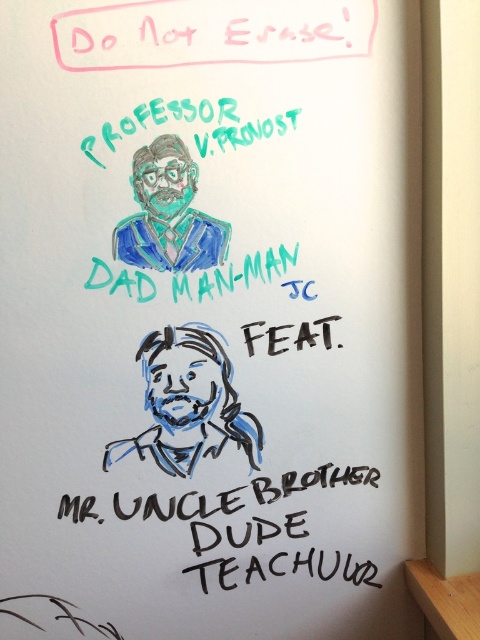
Is blue sketchy man at center taller than black marker text at lower center?

Indeed, blue sketchy man at center has a greater height compared to black marker text at lower center.

Locate an element on the screen. This screenshot has height=640, width=480. blue sketchy man at center is located at coordinates (189, 403).

Can you confirm if blue sketchy man at center is positioned to the left of teal matte suit at upper center?

Yes, blue sketchy man at center is to the left of teal matte suit at upper center.

Between blue sketchy man at center and teal matte suit at upper center, which one has less height?

Standing shorter between the two is teal matte suit at upper center.

Between point (165, 385) and point (173, 170), which one is positioned in front?

Point (173, 170)

This screenshot has width=480, height=640. Find the location of `blue sketchy man at center`. blue sketchy man at center is located at coordinates (189, 403).

Can you confirm if black marker text at lower center is positioned below teal matte suit at upper center?

Correct, black marker text at lower center is located below teal matte suit at upper center.

Between point (255, 499) and point (148, 224), which one is positioned behind?

Point (255, 499)

Identify the location of black marker text at lower center. click(x=241, y=506).